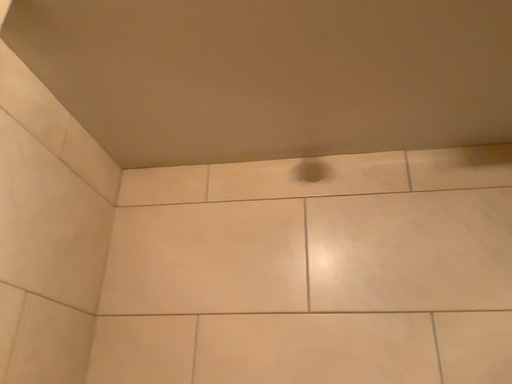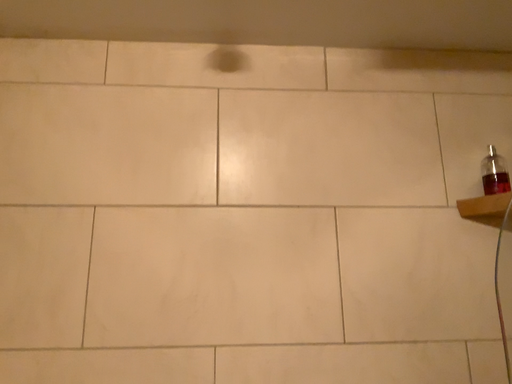
Question: Which way did the camera rotate in the video?

Choices:
 (A) rotated left
 (B) rotated right

Answer: (B)